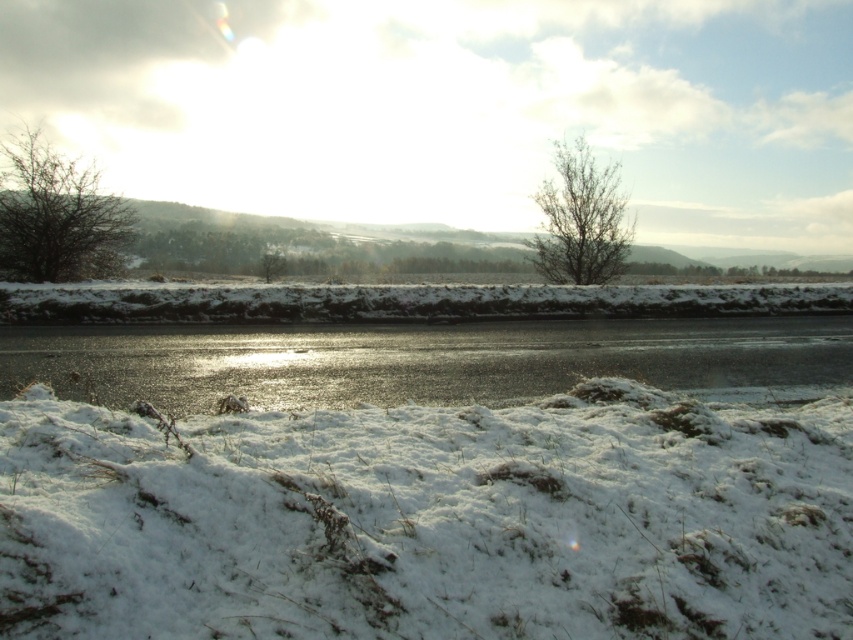
Does white fluffy snow at lower left appear over bare branches at upper center?

No.

Who is more forward, (515, 534) or (624, 214)?

Positioned in front is point (515, 534).

This screenshot has height=640, width=853. I want to click on white fluffy snow at lower left, so click(x=428, y=518).

Image resolution: width=853 pixels, height=640 pixels. Find the location of `white fluffy snow at lower left`. white fluffy snow at lower left is located at coordinates (428, 518).

Locate an element on the screen. white fluffy snow at lower left is located at coordinates (428, 518).

Which is in front, point (624, 529) or point (463, 323)?

Positioned in front is point (624, 529).

You are a GUI agent. You are given a task and a screenshot of the screen. Output one action in this format:
    pyautogui.click(x=<x>, y=<y>)
    Task: Click on the white fluffy snow at lower left
    The image size is (853, 640).
    Given the screenshot: What is the action you would take?
    pyautogui.click(x=428, y=518)

Where is `white fluffy snow at lower left`? The height and width of the screenshot is (640, 853). white fluffy snow at lower left is located at coordinates (428, 518).

Is point (288, 376) behind point (51, 280)?

No, (288, 376) is in front of (51, 280).

Is glistening ice at center positioned at the back of bare branches at left?

No, it is not.

Is point (548, 378) in front of point (26, 250)?

Yes, point (548, 378) is in front of point (26, 250).

This screenshot has width=853, height=640. In order to click on glistening ice at center in this screenshot , I will do `click(418, 358)`.